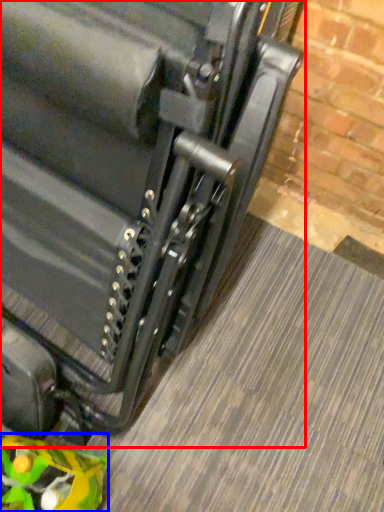
Question: Which point is closer to the camera, suitcase (highlighted by a red box) or toy (highlighted by a blue box)?

Choices:
 (A) suitcase
 (B) toy

Answer: (A)